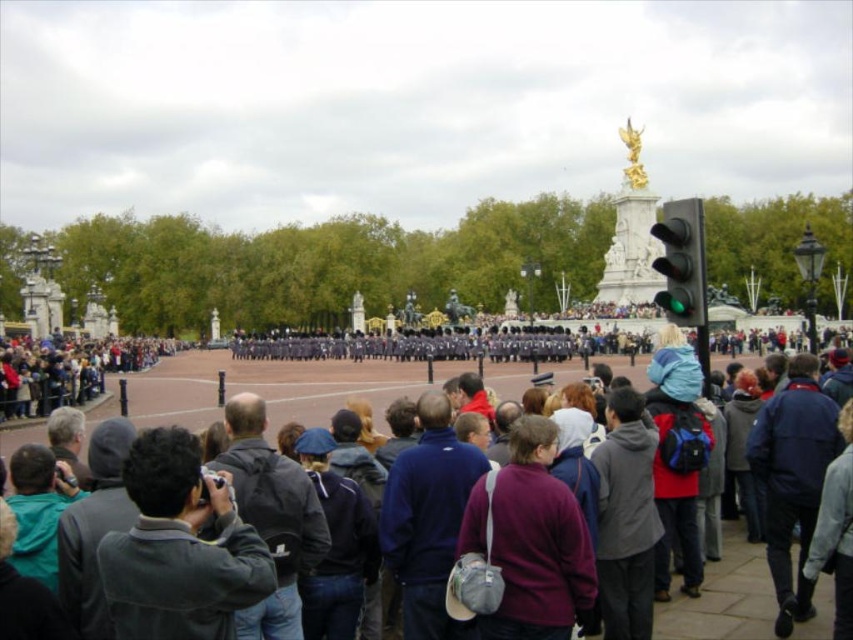
You are a photographer trying to capture a shot of the dark gray jacket at center and the dark gray jacket at left. Which jacket is located to the right of the other?

The dark gray jacket at center is positioned on the right side of dark gray jacket at left.

You are standing at the center of the plaza and want to find the dark gray jacket at center. According to the coordinates provided, in which direction should you move to locate it?

The dark gray jacket at center is located at coordinates point (271, 387). Since you are at the center, you should move to the right and slightly downward to reach the coordinates (271, 387).

You are a photographer trying to capture the crowd and the traffic light in the scene. Given that the dark gray jacket at left is wider than the green glass traffic light at center, which object would appear larger in your photo?

The dark gray jacket at left would appear larger in the photo since its width surpasses that of the green glass traffic light at center.